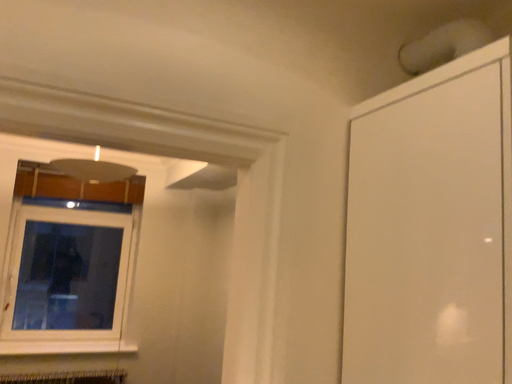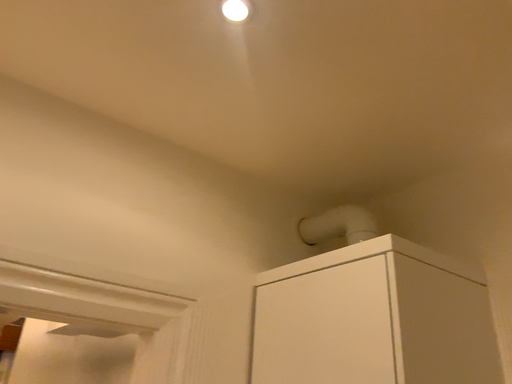
Question: Which way did the camera rotate in the video?

Choices:
 (A) rotated left
 (B) rotated right

Answer: (B)